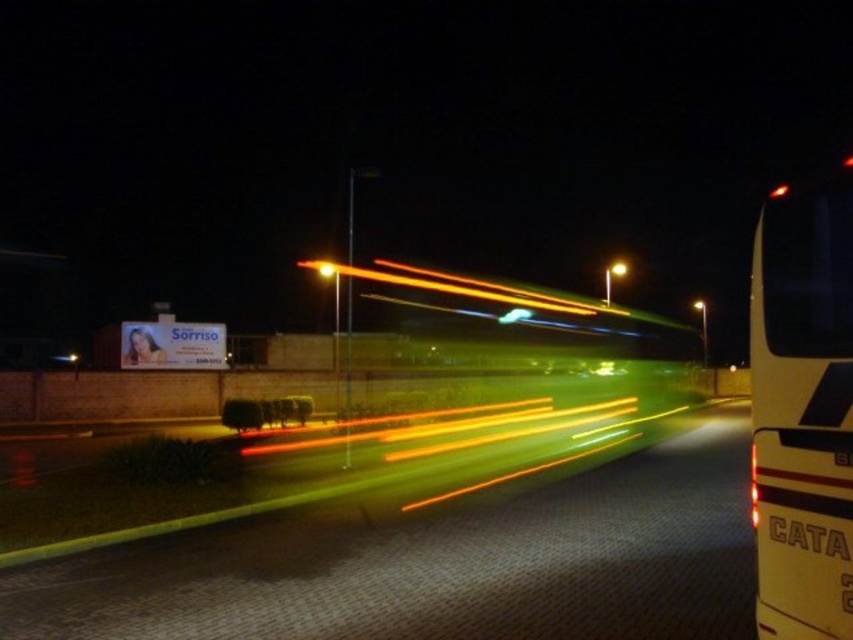
Question: Can you confirm if yellow light trails at center is wider than white matte/decorative bus at right?

Choices:
 (A) yes
 (B) no

Answer: (A)

Question: Which point appears closest to the camera in this image?

Choices:
 (A) (785, 230)
 (B) (218, 582)

Answer: (A)

Question: Is yellow light trails at center above white matte/decorative bus at right?

Choices:
 (A) yes
 (B) no

Answer: (B)

Question: Which point is farther to the camera?

Choices:
 (A) (837, 522)
 (B) (357, 596)

Answer: (B)

Question: Is yellow light trails at center above white matte/decorative bus at right?

Choices:
 (A) yes
 (B) no

Answer: (B)